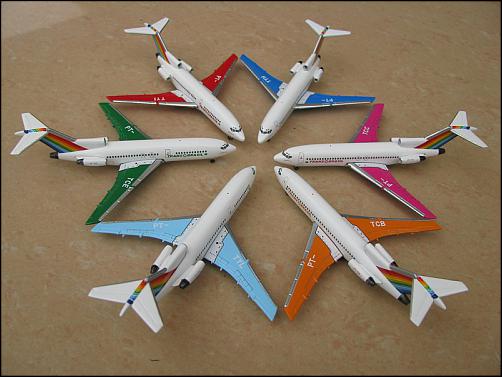
Image resolution: width=502 pixels, height=377 pixels. I want to click on flat surface, so click(276, 220).